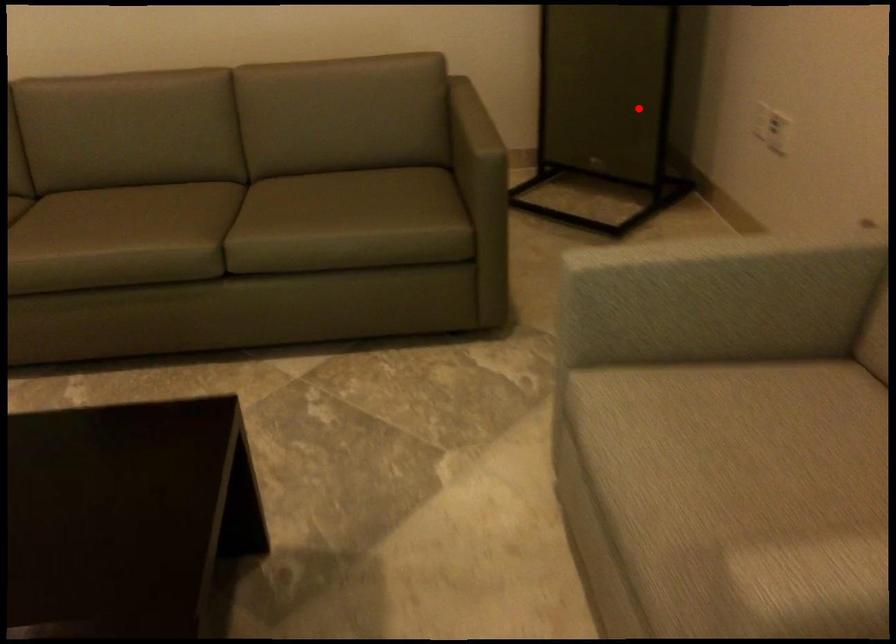
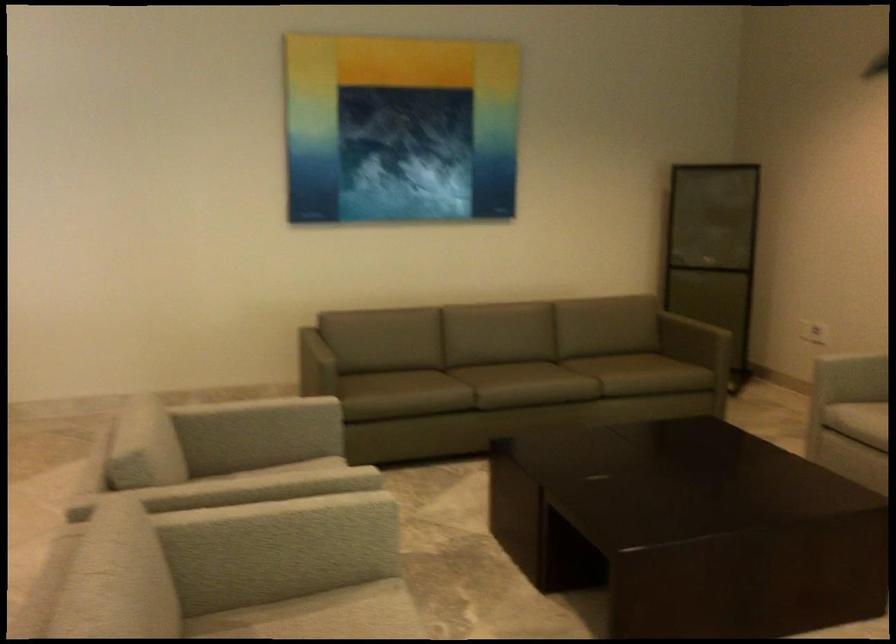
Question: I am providing you with two images of the same scene from different viewpoints. Given a red point in image1, look at the same physical point in image2. Is it:

Choices:
 (A) Closer to the viewpoint
 (B) Farther from the viewpoint

Answer: (B)